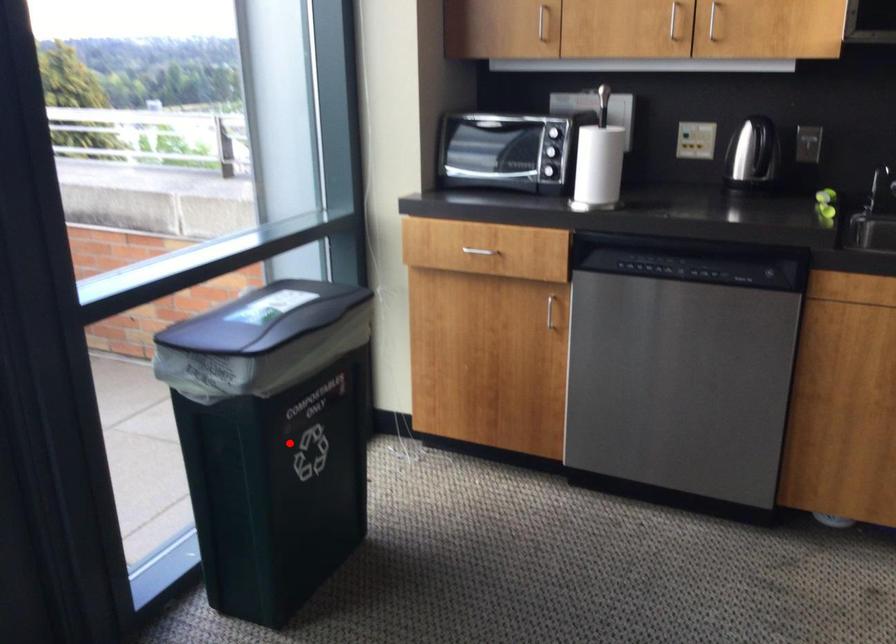
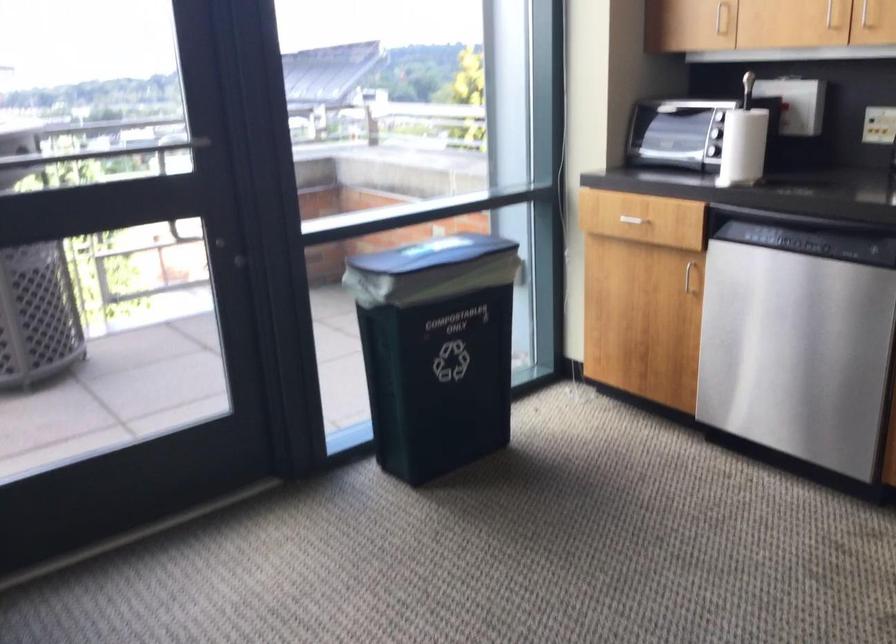
Question: I am providing you with two images of the same scene from different viewpoints. A red point is marked on the first image. Is the red point's position out of view in image 2?

Choices:
 (A) Yes
 (B) No

Answer: (B)